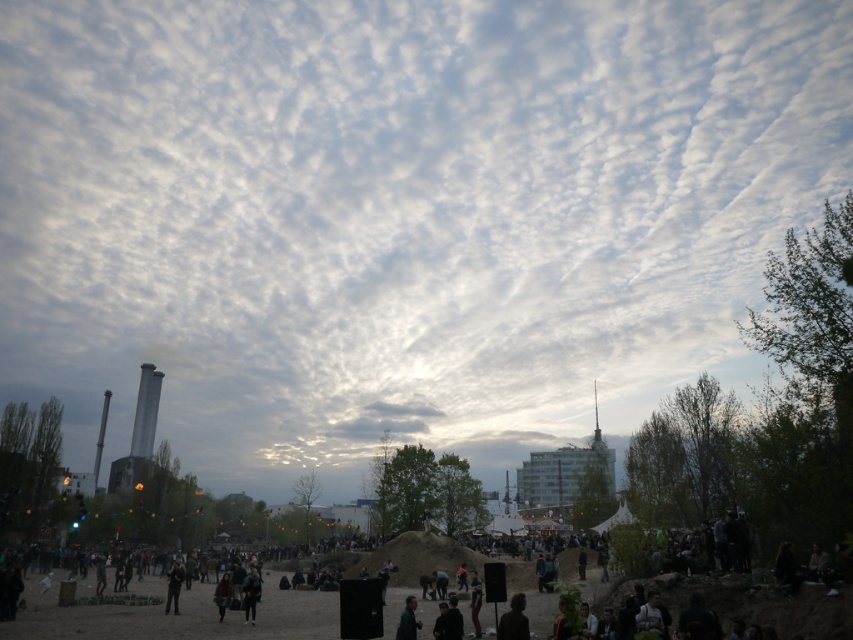
Does point (200, 604) lie behind point (181, 570)?

Yes, it is.

Is point (845, 621) positioned before point (171, 596)?

Yes, it is.

The width and height of the screenshot is (853, 640). I want to click on dark clothing at center, so click(171, 614).